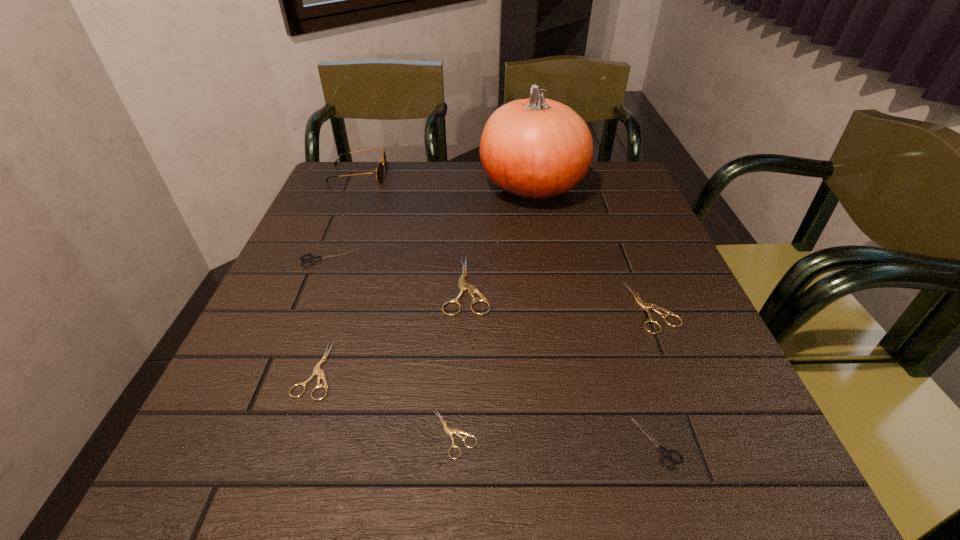
Point out which beige shears is positioned as the second nearest to the nearest beige shears. Please provide its 2D coordinates. Your answer should be formatted as a tuple, i.e. [(x, y)], where the tuple contains the x and y coordinates of a point satisfying the conditions above.

[(463, 285)]

Select which beige shears is the second closest to the biggest beige shears. Please provide its 2D coordinates. Your answer should be formatted as a tuple, i.e. [(x, y)], where the tuple contains the x and y coordinates of a point satisfying the conditions above.

[(449, 431)]

The image size is (960, 540). I want to click on free space that satisfies the following two spatial constraints: 1. on the lenses of the seventh shortest object; 2. on the left side of the nearest beige shears, so click(x=252, y=434).

Identify the location of vacant space that satisfies the following two spatial constraints: 1. on the front side of the smallest beige shears; 2. on the left side of the bigger black shears. (256, 434).

The width and height of the screenshot is (960, 540). I want to click on blank space that satisfies the following two spatial constraints: 1. on the lenses of the seventh shortest object; 2. on the back side of the biggest beige shears, so click(312, 286).